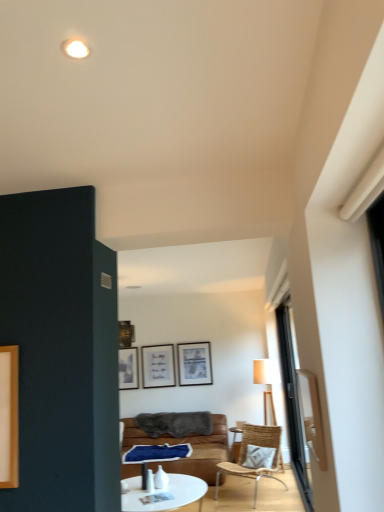
Question: Does woven wood chair at center have a smaller size compared to brown leather couch at center?

Choices:
 (A) no
 (B) yes

Answer: (B)

Question: From a real-world perspective, is woven wood chair at center under brown leather couch at center?

Choices:
 (A) no
 (B) yes

Answer: (B)

Question: Is brown leather couch at center at the back of woven wood chair at center?

Choices:
 (A) no
 (B) yes

Answer: (A)

Question: Is woven wood chair at center thinner than brown leather couch at center?

Choices:
 (A) no
 (B) yes

Answer: (B)

Question: Can you confirm if woven wood chair at center is shorter than brown leather couch at center?

Choices:
 (A) no
 (B) yes

Answer: (B)

Question: Is woven wood chair at center directly adjacent to brown leather couch at center?

Choices:
 (A) yes
 (B) no

Answer: (B)

Question: Is woven wood chair at center shorter than matte black picture frame at upper center?

Choices:
 (A) no
 (B) yes

Answer: (A)

Question: From the image's perspective, would you say woven wood chair at center is positioned over matte black picture frame at upper center?

Choices:
 (A) yes
 (B) no

Answer: (B)

Question: Can you confirm if woven wood chair at center is wider than matte black picture frame at upper center?

Choices:
 (A) no
 (B) yes

Answer: (B)

Question: Is woven wood chair at center far away from matte black picture frame at upper center?

Choices:
 (A) no
 (B) yes

Answer: (B)

Question: Is woven wood chair at center to the right of matte black picture frame at upper center from the viewer's perspective?

Choices:
 (A) yes
 (B) no

Answer: (A)

Question: Can you confirm if woven wood chair at center is thinner than matte black picture frame at upper center?

Choices:
 (A) no
 (B) yes

Answer: (A)

Question: Considering the relative positions of transparent glass door at right and woven wood chair at center in the image provided, is transparent glass door at right in front of woven wood chair at center?

Choices:
 (A) no
 (B) yes

Answer: (A)